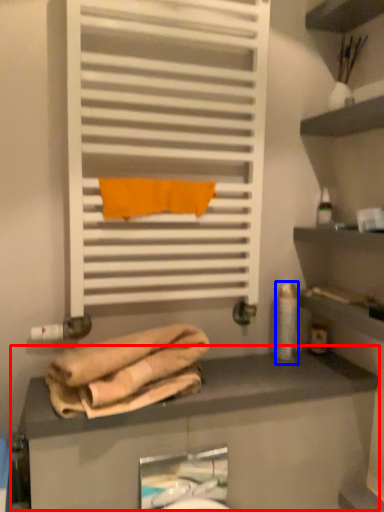
Question: Which of the following is the farthest to the observer, counter (highlighted by a red box) or toiletry (highlighted by a blue box)?

Choices:
 (A) counter
 (B) toiletry

Answer: (B)